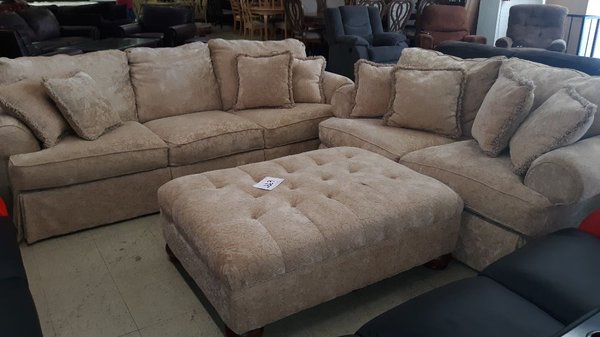
I want to click on white card on ottoman, so click(x=268, y=180).